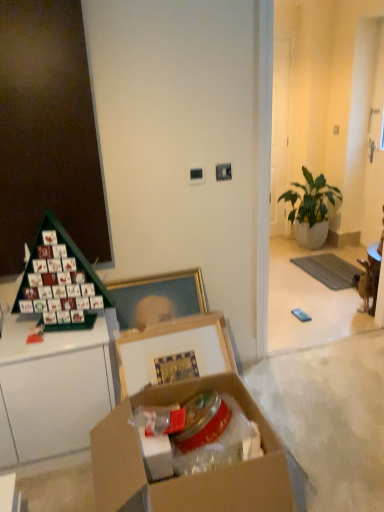
Question: Should I look upward or downward to see green leafy plant in white pot at right?

Choices:
 (A) up
 (B) down

Answer: (A)

Question: Does cardboard box at center have a greater height compared to green leafy plant in white pot at right?

Choices:
 (A) no
 (B) yes

Answer: (A)

Question: From a real-world perspective, is cardboard box at center positioned over green leafy plant in white pot at right based on gravity?

Choices:
 (A) no
 (B) yes

Answer: (A)

Question: Are cardboard box at center and green leafy plant in white pot at right making contact?

Choices:
 (A) no
 (B) yes

Answer: (A)

Question: Does cardboard box at center have a lesser height compared to green leafy plant in white pot at right?

Choices:
 (A) no
 (B) yes

Answer: (B)

Question: Is green leafy plant in white pot at right inside cardboard box at center?

Choices:
 (A) no
 (B) yes

Answer: (A)

Question: Does cardboard box at center come behind green leafy plant in white pot at right?

Choices:
 (A) no
 (B) yes

Answer: (A)

Question: Would you say green leafy plant in white pot at right is outside cardboard box at center?

Choices:
 (A) yes
 (B) no

Answer: (A)

Question: Is green leafy plant in white pot at right placed right next to cardboard box at center?

Choices:
 (A) yes
 (B) no

Answer: (B)

Question: From a real-world perspective, is green leafy plant in white pot at right located beneath cardboard box at center?

Choices:
 (A) no
 (B) yes

Answer: (A)

Question: Is cardboard box at center at the back of green leafy plant in white pot at right?

Choices:
 (A) yes
 (B) no

Answer: (B)

Question: Considering the relative sizes of green leafy plant in white pot at right and cardboard box at center in the image provided, is green leafy plant in white pot at right shorter than cardboard box at center?

Choices:
 (A) no
 (B) yes

Answer: (A)

Question: Is the depth of green leafy plant in white pot at right greater than that of cardboard box at center?

Choices:
 (A) yes
 (B) no

Answer: (A)

Question: Relative to green leafy plant in white pot at right, is cardboard box at center in front or behind?

Choices:
 (A) behind
 (B) front

Answer: (B)